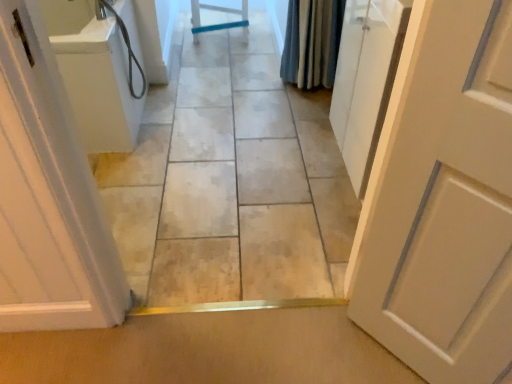
Question: Does white glossy door at left, which is counted as the second door, starting from the right, contain smooth tile floor at center?

Choices:
 (A) no
 (B) yes

Answer: (A)

Question: Is white glossy door at left, which is counted as the second door, starting from the right, bigger than smooth tile floor at center?

Choices:
 (A) yes
 (B) no

Answer: (B)

Question: Considering the relative positions of white glossy door at left, which is counted as the second door, starting from the right, and smooth tile floor at center in the image provided, is white glossy door at left, which is counted as the second door, starting from the right, to the left of smooth tile floor at center from the viewer's perspective?

Choices:
 (A) no
 (B) yes

Answer: (B)

Question: Is the surface of white glossy door at left, which ranks as the first door in left-to-right order, in direct contact with smooth tile floor at center?

Choices:
 (A) yes
 (B) no

Answer: (B)

Question: From a real-world perspective, is white glossy door at left, which ranks as the first door in left-to-right order, located beneath smooth tile floor at center?

Choices:
 (A) no
 (B) yes

Answer: (A)

Question: From their relative heights in the image, would you say blue textured fabric shower curtain at upper right is taller or shorter than white matte door at right, arranged as the 2th door when viewed from the left?

Choices:
 (A) tall
 (B) short

Answer: (B)

Question: From a real-world perspective, is blue textured fabric shower curtain at upper right above or below white matte door at right, the first door viewed from the right?

Choices:
 (A) below
 (B) above

Answer: (A)

Question: Relative to white matte door at right, the first door viewed from the right, is blue textured fabric shower curtain at upper right in front or behind?

Choices:
 (A) behind
 (B) front

Answer: (A)

Question: Would you say blue textured fabric shower curtain at upper right is to the left or to the right of white matte door at right, the first door viewed from the right, in the picture?

Choices:
 (A) right
 (B) left

Answer: (B)

Question: From the image's perspective, is white matte door at right, arranged as the 2th door when viewed from the left, positioned above or below white glossy door at left, which is counted as the second door, starting from the right?

Choices:
 (A) below
 (B) above

Answer: (A)

Question: Considering the positions of white matte door at right, arranged as the 2th door when viewed from the left, and white glossy door at left, which ranks as the first door in left-to-right order, in the image, is white matte door at right, arranged as the 2th door when viewed from the left, wider or thinner than white glossy door at left, which ranks as the first door in left-to-right order,?

Choices:
 (A) thin
 (B) wide

Answer: (A)

Question: Based on their positions, is white matte door at right, arranged as the 2th door when viewed from the left, located to the left or right of white glossy door at left, which is counted as the second door, starting from the right?

Choices:
 (A) right
 (B) left

Answer: (A)

Question: From a real-world perspective, is white matte door at right, arranged as the 2th door when viewed from the left, positioned above or below white glossy door at left, which is counted as the second door, starting from the right?

Choices:
 (A) above
 (B) below

Answer: (A)

Question: Visually, is white matte door at right, the first door viewed from the right, positioned to the left or to the right of blue textured fabric shower curtain at upper right?

Choices:
 (A) left
 (B) right

Answer: (B)

Question: Is white matte door at right, the first door viewed from the right, bigger or smaller than blue textured fabric shower curtain at upper right?

Choices:
 (A) big
 (B) small

Answer: (A)